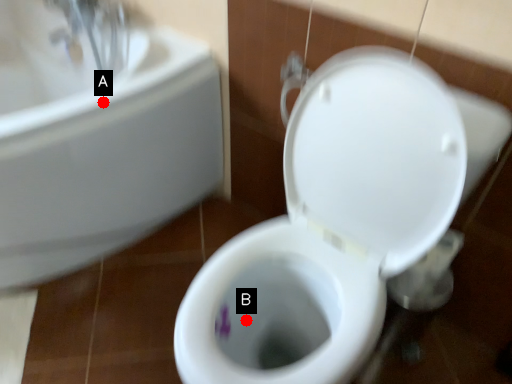
Question: Two points are circled on the image, labeled by A and B beside each circle. Which point is closer to the camera taking this photo?

Choices:
 (A) A is closer
 (B) B is closer

Answer: (B)